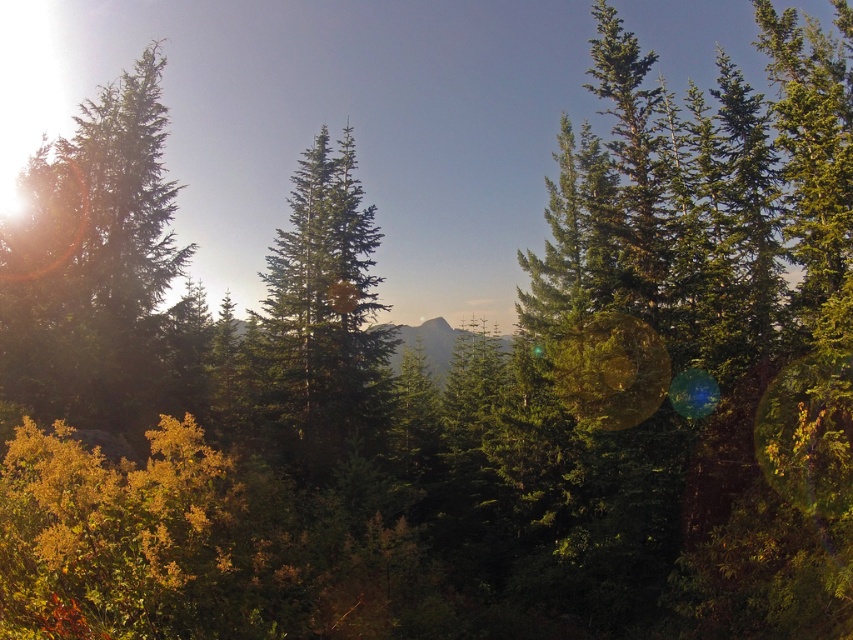
You are standing in the forest scene and want to find the green matte tree at left. According to the coordinates provided, where should you look relative to your position?

The green matte tree at left is located at point coordinates, so you should look towards the lower left area of the scene since the coordinates indicate it is positioned at 0.427 on the x and 0.120 on the y axis, which corresponds to the lower left quadrant.

You are standing in the forest scene and want to walk from the point at coordinates point (x=19, y=188) to the point at coordinates point (x=418, y=333). Which direction should you face to move towards the second point?

Since point (x=19, y=188) is closer to the viewer than point (x=418, y=333), you should face away from the direction of the viewer to move towards the second point.